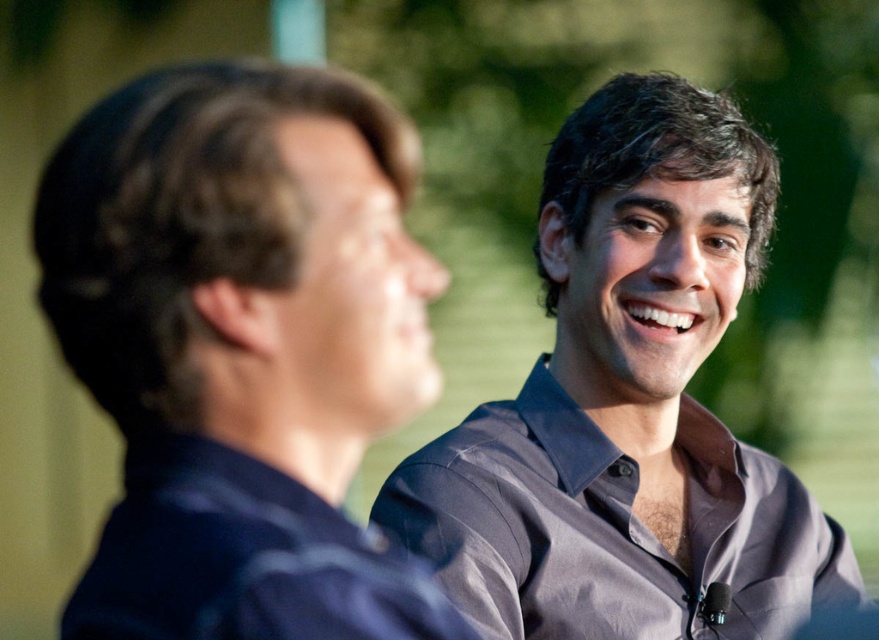
Can you confirm if gray matte dress shirt at right is bigger than gray satin dress shirt at center?

Yes, gray matte dress shirt at right is bigger than gray satin dress shirt at center.

Between point (856, 588) and point (513, 636), which one is positioned behind?

The point (856, 588) is behind.

Which is behind, point (591, 625) or point (496, 531)?

Positioned behind is point (496, 531).

Where is `gray matte dress shirt at right`? The height and width of the screenshot is (640, 879). gray matte dress shirt at right is located at coordinates (628, 406).

Is the position of dark blue shirt at left more distant than that of gray satin dress shirt at center?

No, dark blue shirt at left is in front of gray satin dress shirt at center.

Does dark blue shirt at left appear under gray satin dress shirt at center?

Incorrect, dark blue shirt at left is not positioned below gray satin dress shirt at center.

At what (x,y) coordinates should I click in order to perform the action: click on dark blue shirt at left. Please return your answer as a coordinate pair (x, y). The image size is (879, 640). Looking at the image, I should click on (242, 348).

Find the location of `dark blue shirt at left`. dark blue shirt at left is located at coordinates (242, 348).

Who is higher up, dark blue shirt at left or gray matte dress shirt at right?

Positioned higher is dark blue shirt at left.

This screenshot has width=879, height=640. Describe the element at coordinates (242, 348) in the screenshot. I see `dark blue shirt at left` at that location.

Find the location of a particular element. The height and width of the screenshot is (640, 879). dark blue shirt at left is located at coordinates (242, 348).